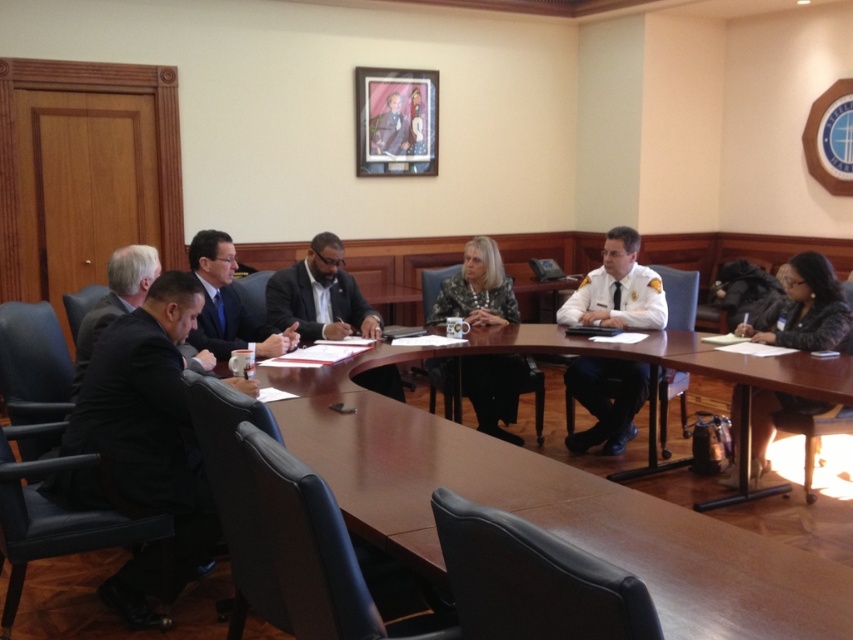
Question: Among these objects, which one is farthest from the camera?

Choices:
 (A) black fur coat at lower right
 (B) white uniform at center

Answer: (B)

Question: Can you confirm if white uniform at center is wider than dark gray suit at center?

Choices:
 (A) no
 (B) yes

Answer: (A)

Question: Which point is farther from the camera taking this photo?

Choices:
 (A) (570, 300)
 (B) (761, 420)

Answer: (A)

Question: Which object is closer to the camera taking this photo?

Choices:
 (A) dark gray suit at center
 (B) white uniform at center

Answer: (A)

Question: Can you confirm if brown polished wood table at center is positioned above matte black suit at center?

Choices:
 (A) yes
 (B) no

Answer: (B)

Question: Does brown polished wood table at center have a larger size compared to camouflage-patterned shirt at center?

Choices:
 (A) no
 (B) yes

Answer: (B)